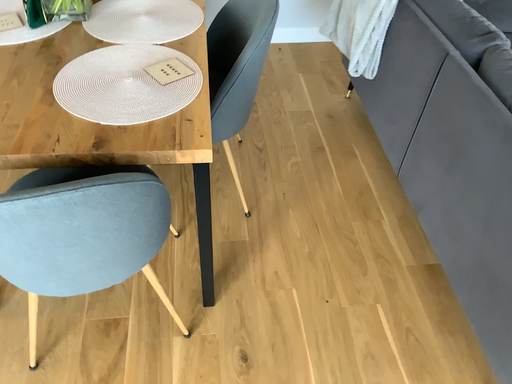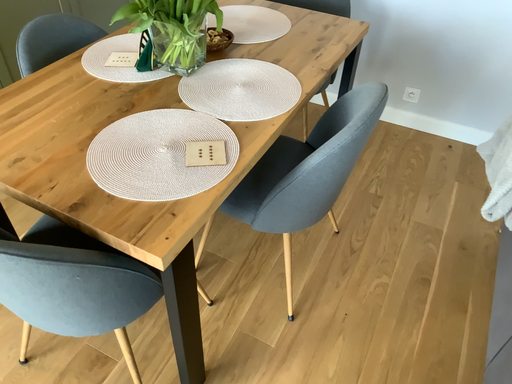
Question: How did the camera likely rotate when shooting the video?

Choices:
 (A) rotated left
 (B) rotated right

Answer: (A)